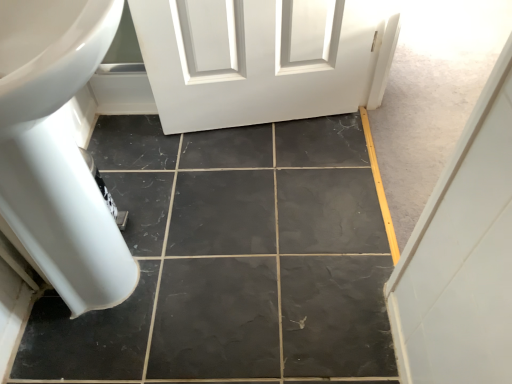
You are a GUI agent. You are given a task and a screenshot of the screen. Output one action in this format:
    pyautogui.click(x=<x>, y=<y>)
    Task: Click on the white glossy bath at left
    This screenshot has height=384, width=512.
    Given the screenshot: What is the action you would take?
    pyautogui.click(x=57, y=150)

The width and height of the screenshot is (512, 384). What do you see at coordinates (57, 150) in the screenshot?
I see `white glossy bath at left` at bounding box center [57, 150].

Describe the element at coordinates (232, 261) in the screenshot. I see `black marble tile at center` at that location.

Measure the distance between point (202, 248) and camera.

Point (202, 248) is 4.09 feet away from camera.

At what (x,y) coordinates should I click in order to perform the action: click on black marble tile at center. Please return your answer as a coordinate pair (x, y). This screenshot has width=512, height=384. Looking at the image, I should click on (232, 261).

In order to face black marble tile at center, should I rotate leftwards or rightwards?

A 4.622 degree turn to the left will do.

Find the location of a particular element. Image resolution: width=512 pixels, height=384 pixels. white glossy bath at left is located at coordinates (57, 150).

Based on the photo, visually, is white glossy bath at left positioned to the left or to the right of black marble tile at center?

From the image, it's evident that white glossy bath at left is to the left of black marble tile at center.

Relative to black marble tile at center, is white glossy bath at left in front or behind?

Clearly, white glossy bath at left is in front of black marble tile at center.

Does point (81, 284) come closer to viewer compared to point (338, 329)?

Yes, point (81, 284) is closer to viewer.

Looking at this image, from the image's perspective, is white glossy bath at left positioned above or below black marble tile at center?

From the image's perspective, white glossy bath at left appears above black marble tile at center.

From a real-world perspective, who is located higher, white glossy bath at left or black marble tile at center?

In real-world perspective, white glossy bath at left is above.

Does white glossy bath at left have a lesser width compared to black marble tile at center?

Yes, white glossy bath at left is thinner than black marble tile at center.

Is white glossy bath at left taller or shorter than black marble tile at center?

Clearly, white glossy bath at left is taller compared to black marble tile at center.

Is white glossy bath at left smaller than black marble tile at center?

Incorrect, white glossy bath at left is not smaller in size than black marble tile at center.

Is black marble tile at center located within white glossy bath at left?

No, black marble tile at center is not surrounded by white glossy bath at left.

Is white glossy bath at left beside black marble tile at center?

No, white glossy bath at left is not touching black marble tile at center.

Is white glossy bath at left facing towards black marble tile at center?

Yes, white glossy bath at left is facing black marble tile at center.

What's the angular difference between white glossy bath at left and black marble tile at center's facing directions?

1.3 degrees separate the facing orientations of white glossy bath at left and black marble tile at center.

I want to click on bath in front of the black marble tile at center, so click(57, 150).

Is black marble tile at center at the left side of white glossy bath at left?

No, black marble tile at center is not to the left of white glossy bath at left.

In the image, is black marble tile at center positioned in front of or behind white glossy bath at left?

black marble tile at center is behind white glossy bath at left.

Does point (144, 157) lie behind point (129, 282)?

Yes, it is.

From the image's perspective, is black marble tile at center above white glossy bath at left?

Actually, black marble tile at center appears below white glossy bath at left in the image.

From a real-world perspective, which is physically above, black marble tile at center or white glossy bath at left?

From a 3D spatial view, white glossy bath at left is above.

Consider the image. Which of these two, black marble tile at center or white glossy bath at left, is thinner?

white glossy bath at left.

Between black marble tile at center and white glossy bath at left, which one has more height?

Standing taller between the two is white glossy bath at left.

In the scene shown: Considering the sizes of objects black marble tile at center and white glossy bath at left in the image provided, who is smaller, black marble tile at center or white glossy bath at left?

black marble tile at center.

Which is correct: black marble tile at center is inside white glossy bath at left, or outside of it?

black marble tile at center exists outside the volume of white glossy bath at left.

Is black marble tile at center far from white glossy bath at left?

No, black marble tile at center is in close proximity to white glossy bath at left.

Is black marble tile at center looking in the opposite direction of white glossy bath at left?

No, white glossy bath at left is not at the back of black marble tile at center.

Measure the distance from black marble tile at center to white glossy bath at left.

black marble tile at center is 15.45 inches from white glossy bath at left.

Identify the location of bath above the black marble tile at center (from a real-world perspective). (57, 150).

Where is `ceramic tile below the white glossy bath at left (from the image's perspective)`? ceramic tile below the white glossy bath at left (from the image's perspective) is located at coordinates (232, 261).

Where is `bath above the black marble tile at center (from a real-world perspective)`? The width and height of the screenshot is (512, 384). bath above the black marble tile at center (from a real-world perspective) is located at coordinates (57, 150).